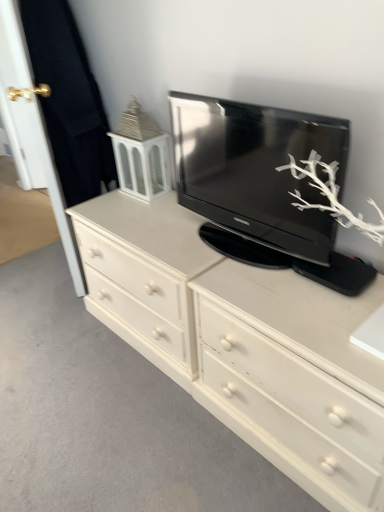
Find the location of a particular element. The height and width of the screenshot is (512, 384). free space to the left of gold metallic door handle at upper left, the first door when ordered from left to right is located at coordinates (19, 196).